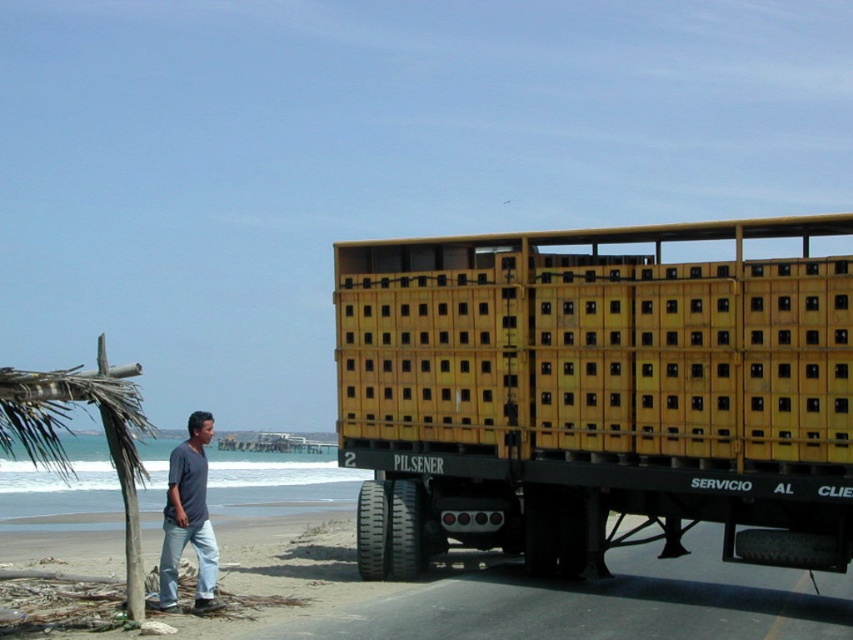
In the scene shown: Between yellow matte trailer truck at center and dark blue t-shirt at lower left, which one is positioned higher?

yellow matte trailer truck at center

Is yellow matte trailer truck at center thinner than dark blue t-shirt at lower left?

Yes, yellow matte trailer truck at center is thinner than dark blue t-shirt at lower left.

What are the coordinates of `yellow matte trailer truck at center` in the screenshot? It's located at (596, 394).

Find the location of a particular element. The image size is (853, 640). yellow matte trailer truck at center is located at coordinates (596, 394).